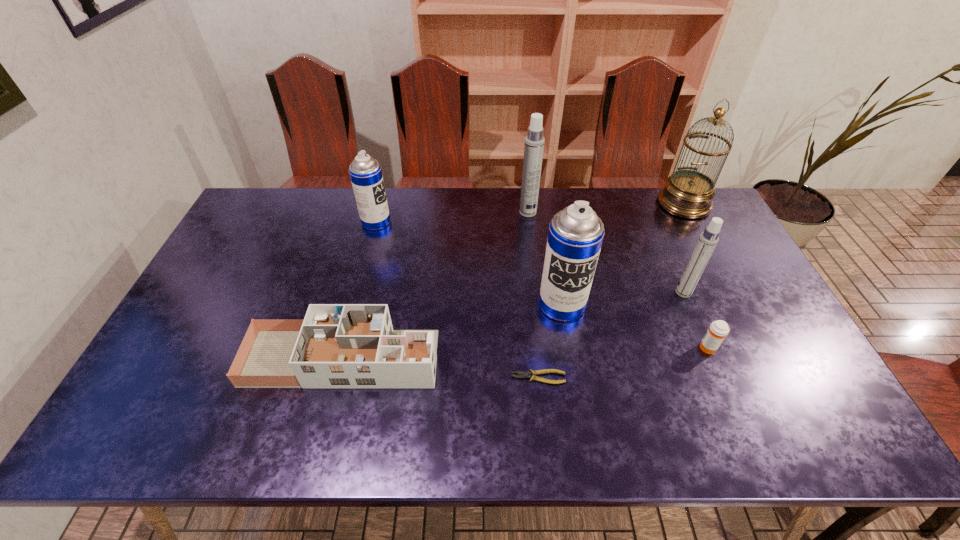
Locate an element on the screen. dollhouse is located at coordinates (336, 345).

What are the coordinates of `orange medicine` in the screenshot? It's located at (718, 330).

At what (x,y) coordinates should I click in order to perform the action: click on the shortest object. Please return your answer as a coordinate pair (x, y). The height and width of the screenshot is (540, 960). Looking at the image, I should click on (521, 374).

You are a GUI agent. You are given a task and a screenshot of the screen. Output one action in this format:
    pyautogui.click(x=<x>, y=<y>)
    Task: Click on the pliers
    The image size is (960, 540).
    Given the screenshot: What is the action you would take?
    pyautogui.click(x=521, y=374)

Identify the location of free location located with an open door on the rightmost object. Image resolution: width=960 pixels, height=540 pixels. (739, 309).

Locate an element on the screen. The height and width of the screenshot is (540, 960). free space located 0.050m on the front of the bigger white aerosol can is located at coordinates (530, 227).

Where is `vacant space situated on the label side of the nearer blue aerosol can`? The width and height of the screenshot is (960, 540). vacant space situated on the label side of the nearer blue aerosol can is located at coordinates (575, 384).

The image size is (960, 540). What are the coordinates of `blank space located 0.210m on the front of the rightmost aerosol can` in the screenshot? It's located at (712, 360).

Where is `vacant area located 0.260m on the label side of the farther blue aerosol can`? vacant area located 0.260m on the label side of the farther blue aerosol can is located at coordinates (466, 222).

You are a GUI agent. You are given a task and a screenshot of the screen. Output one action in this format:
    pyautogui.click(x=<x>, y=<y>)
    Task: Click on the vacant region located 0.180m at the entrance of the dollhouse
    
    Given the screenshot: What is the action you would take?
    pyautogui.click(x=507, y=358)